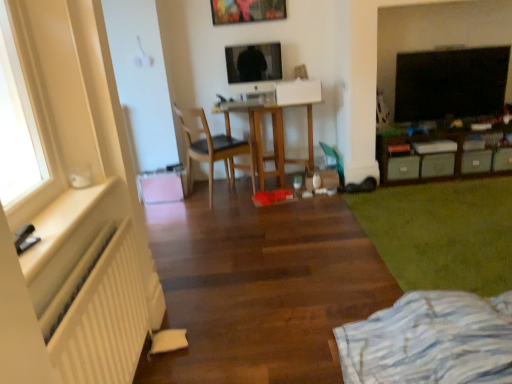
The image size is (512, 384). I want to click on free space above white matte radiator at lower left (from a real-world perspective), so click(x=74, y=287).